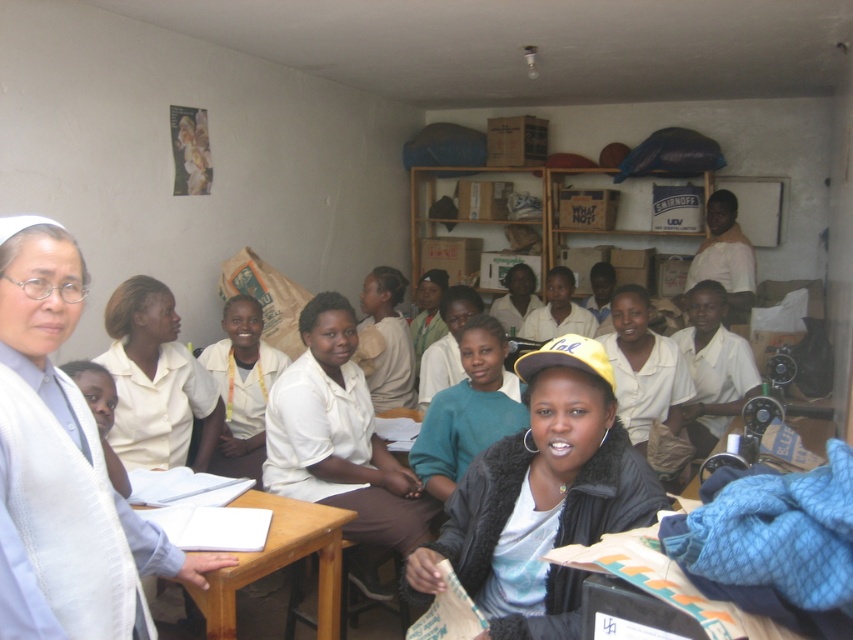
Question: Among these points, which one is farthest from the camera?

Choices:
 (A) (550, 420)
 (B) (454, 385)

Answer: (B)

Question: Among these points, which one is nearest to the camera?

Choices:
 (A) (158, 426)
 (B) (699, 257)
 (C) (16, 488)
 (D) (427, 461)

Answer: (C)

Question: Is white matte shirt at center to the left of white uniform shirt at center from the viewer's perspective?

Choices:
 (A) yes
 (B) no

Answer: (B)

Question: Considering the relative positions of teal matte sweater at center and white shirt at upper center in the image provided, where is teal matte sweater at center located with respect to white shirt at upper center?

Choices:
 (A) left
 (B) right

Answer: (A)

Question: Based on their relative distances, which object is nearer to the white matte vest at left?

Choices:
 (A) white matte shirt at center
 (B) white uniform shirt at center
 (C) wooden table at center
 (D) yellow fabric cap at center

Answer: (C)

Question: Is wooden table at center below white shirt at upper center?

Choices:
 (A) yes
 (B) no

Answer: (A)